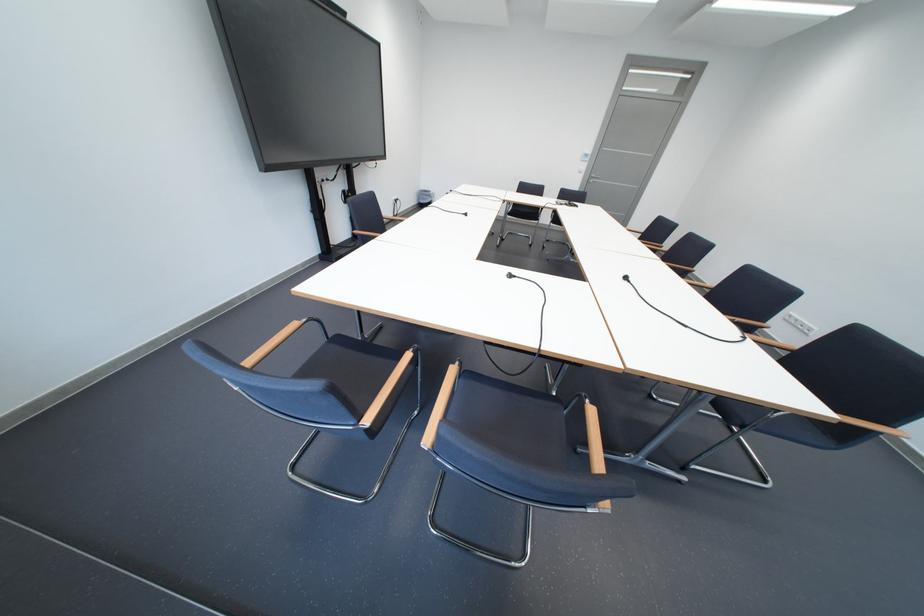
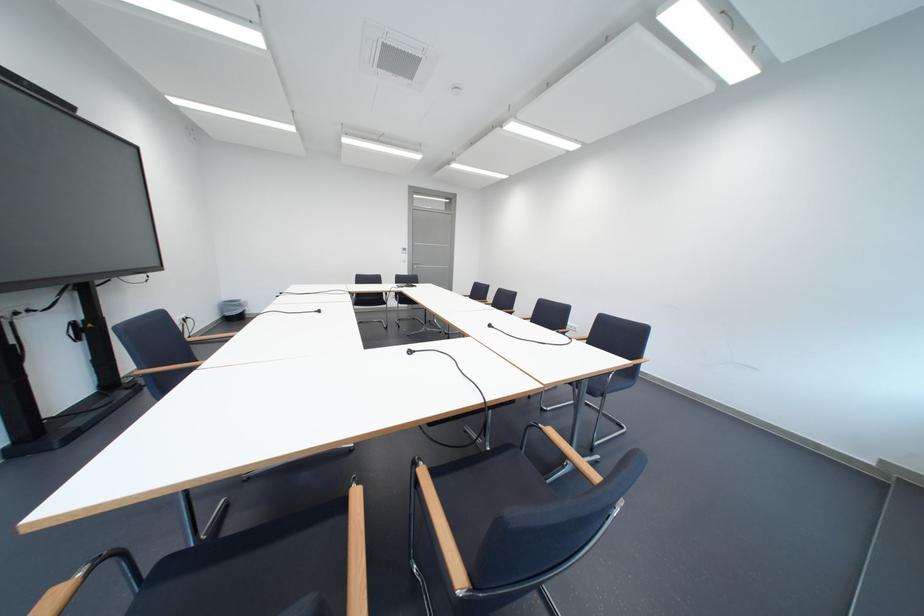
Question: I am providing you with two images of the same scene from different viewpoints. Which of the following objects are not visible in image2?

Choices:
 (A) vertical door handle
 (B) chair sitting surface
 (C) wooden chair armrest
 (D) none of these

Answer: (D)